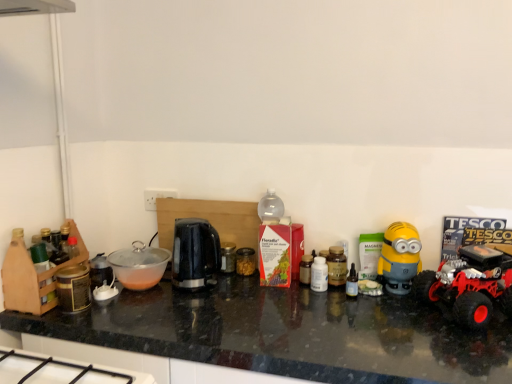
Locate an element on the screen. The height and width of the screenshot is (384, 512). free location in front of translucent plastic bottle at center, placed as the fourth bottle when sorted from left to right is located at coordinates (373, 321).